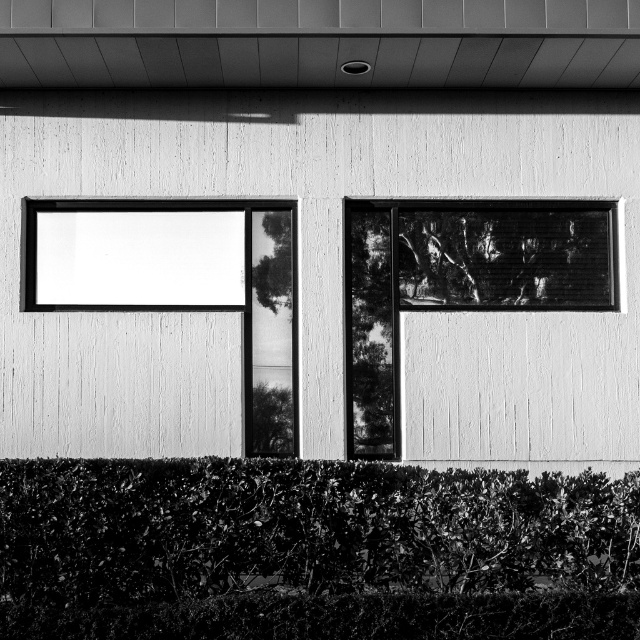
You are standing in front of the building and want to take a photo of the green leafy hedge at lower center without the transparent glass window at upper left blocking the view. Is it possible to do so based on their positions?

The green leafy hedge at lower center is in front of the transparent glass window at upper left, so you can take a photo of the green leafy hedge at lower center without the transparent glass window at upper left blocking the view because the hedge is closer to you than the window.

You are standing in front of the building shown in the image. You notice a point at coordinates (182,282). Which object does this point belong to?

The point at coordinates (182,282) belongs to the transparent glass window at upper left.

You are a landscape architect designing a garden path that needs to pass between the green leafy hedge at lower center and the smooth glass window at center right. Based on their widths, can the path be 1.2 meters wide?

The green leafy hedge at lower center might be wider than the smooth glass window at center right, but without exact measurements, it is uncertain if the path can be 1.2 meters wide. Further measurements are needed.